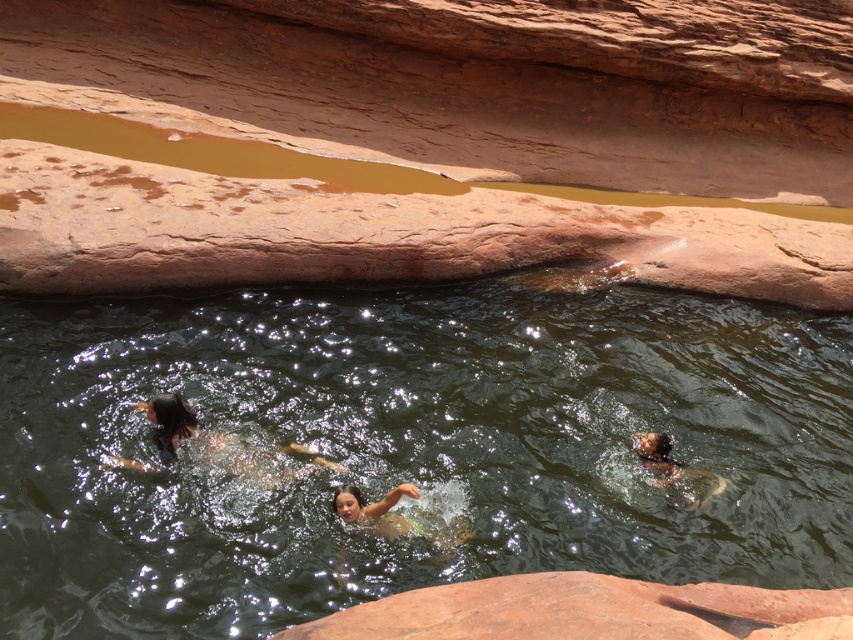
Is point (387, 524) in front of point (688, 508)?

Yes, point (387, 524) is closer to viewer.

Looking at this image, who is shorter, smooth skin person at center or smooth brown skin at lower right?

With less height is smooth skin person at center.

This screenshot has height=640, width=853. I want to click on smooth skin person at center, so click(x=393, y=516).

Which is in front, point (183, 410) or point (447, 528)?

Point (447, 528) is more forward.

Based on the photo, who is more distant from viewer, [271,481] or [397,499]?

Positioned behind is point [271,481].

I want to click on brown fur dog at center, so click(222, 444).

Can you confirm if brown fur dog at center is positioned to the left of smooth brown skin at lower right?

Yes, brown fur dog at center is to the left of smooth brown skin at lower right.

Does point (202, 440) come behind point (659, 472)?

No, it is in front of (659, 472).

Find the location of `brown fur dog at center`. brown fur dog at center is located at coordinates (222, 444).